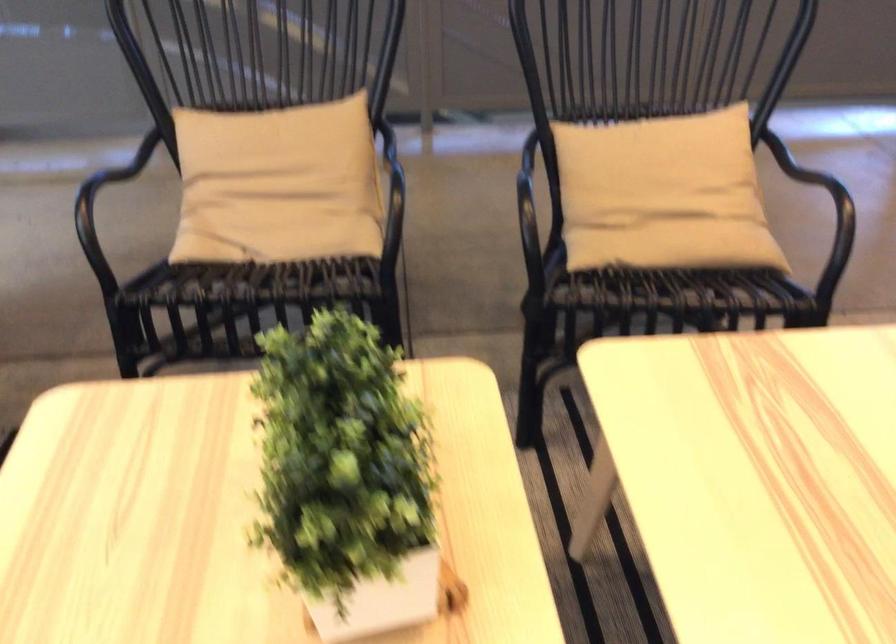
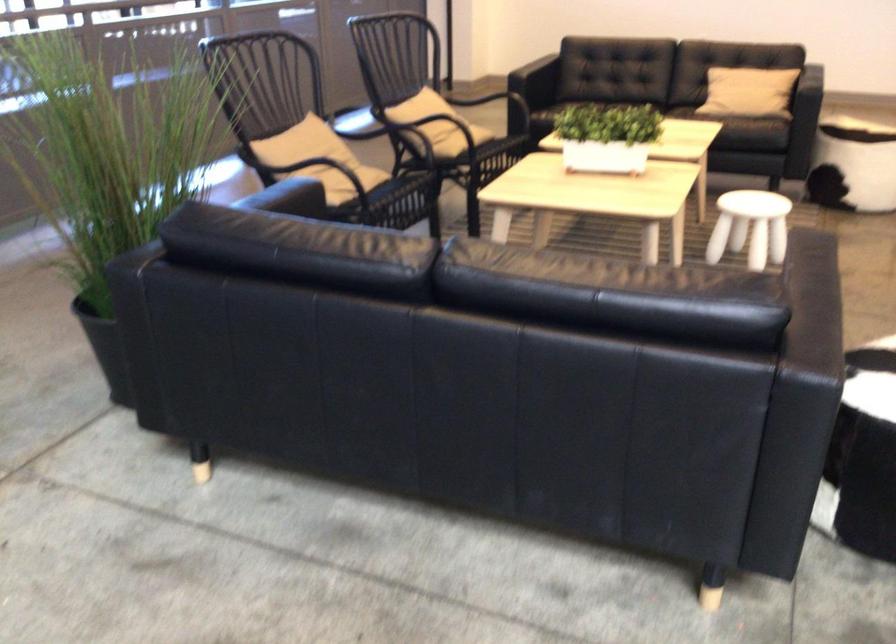
Locate, in the second image, the point that corresponds to (243,162) in the first image.

(308, 153)